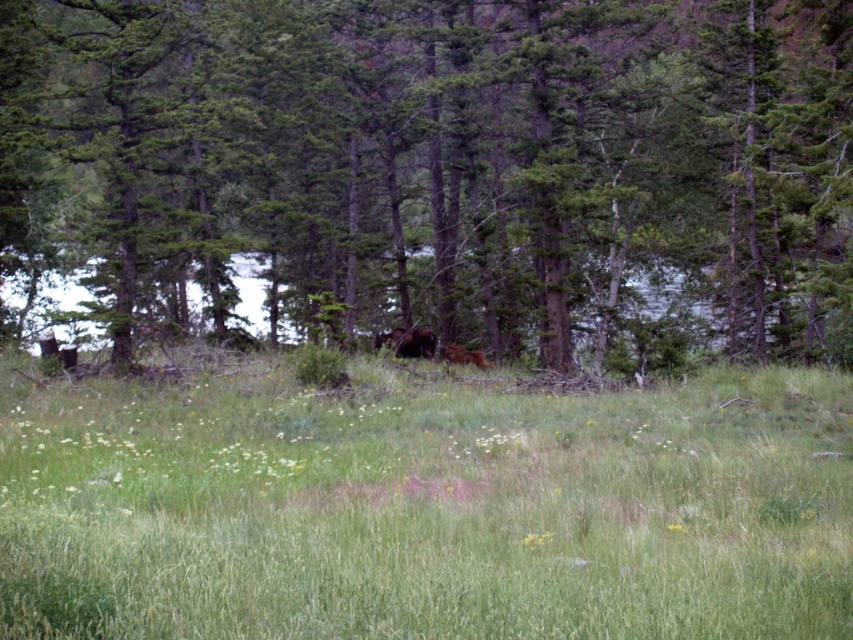
Question: Is green textured tree at center to the left of green grassy field at center from the viewer's perspective?

Choices:
 (A) no
 (B) yes

Answer: (B)

Question: Does green textured tree at center come in front of brown furry bear at center?

Choices:
 (A) yes
 (B) no

Answer: (A)

Question: Based on their relative distances, which object is nearer to the green grassy field at center?

Choices:
 (A) brown furry bear at center
 (B) green textured tree at center

Answer: (B)

Question: Among these objects, which one is nearest to the camera?

Choices:
 (A) brown furry bear at center
 (B) green textured tree at center
 (C) green grassy field at center

Answer: (C)

Question: Which of the following is the closest to the observer?

Choices:
 (A) green grassy field at center
 (B) brown furry bear at center

Answer: (A)

Question: Does green grassy field at center have a smaller size compared to brown furry bear at center?

Choices:
 (A) no
 (B) yes

Answer: (A)